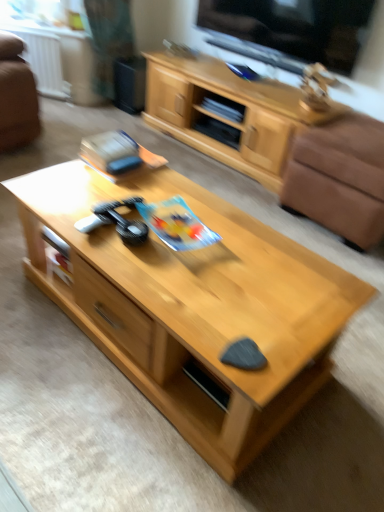
Identify the location of free spot above light wood coffee table at center (from a real-world perspective). (187, 230).